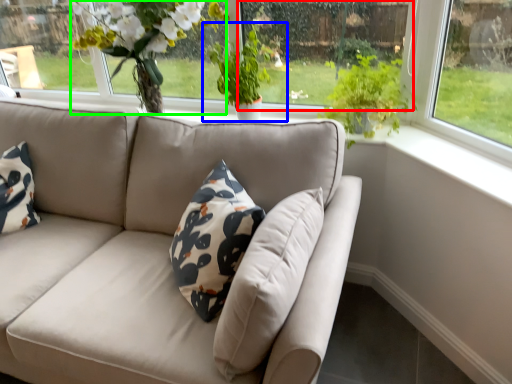
Question: Based on their relative distances, which object is farther from window screen (highlighted by a red box)? Choose from houseplant (highlighted by a blue box) and floral arrangement (highlighted by a green box).

Choices:
 (A) houseplant
 (B) floral arrangement

Answer: (B)